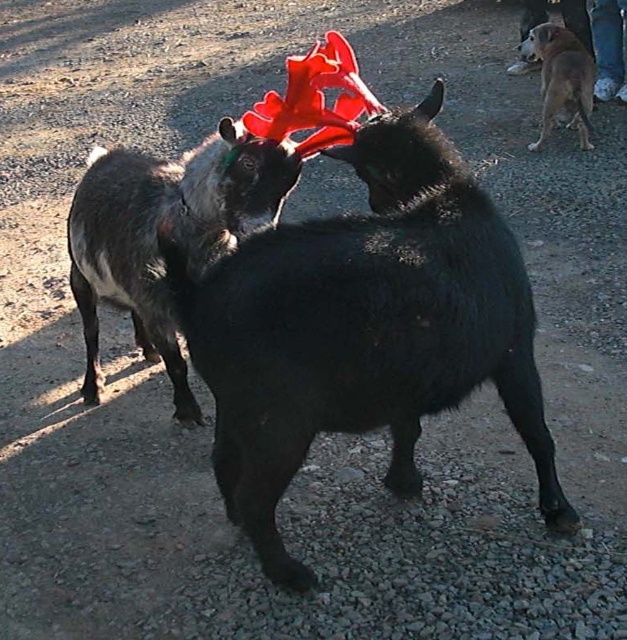
Does black matte antlers at center have a greater height compared to dark gray woolen goat at center?

Yes.

Is black matte antlers at center positioned at the back of dark gray woolen goat at center?

No, black matte antlers at center is closer to the viewer.

The width and height of the screenshot is (627, 640). Identify the location of black matte antlers at center. point(364,328).

Locate an element on the screen. black matte antlers at center is located at coordinates (364, 328).

Does black matte antlers at center have a greater height compared to brown furry dog at upper right?

Yes, black matte antlers at center is taller than brown furry dog at upper right.

Who is lower down, black matte antlers at center or brown furry dog at upper right?

black matte antlers at center

Based on the photo, who is more forward, (x=258, y=308) or (x=537, y=40)?

Point (x=258, y=308) is in front.

The height and width of the screenshot is (640, 627). Find the location of `black matte antlers at center`. black matte antlers at center is located at coordinates (364, 328).

Which is more to the right, dark gray woolen goat at center or brown furry dog at upper right?

brown furry dog at upper right is more to the right.

Is point (186, 214) positioned before point (587, 125)?

Yes, point (186, 214) is in front of point (587, 125).

Where is `dark gray woolen goat at center`? This screenshot has width=627, height=640. dark gray woolen goat at center is located at coordinates (171, 230).